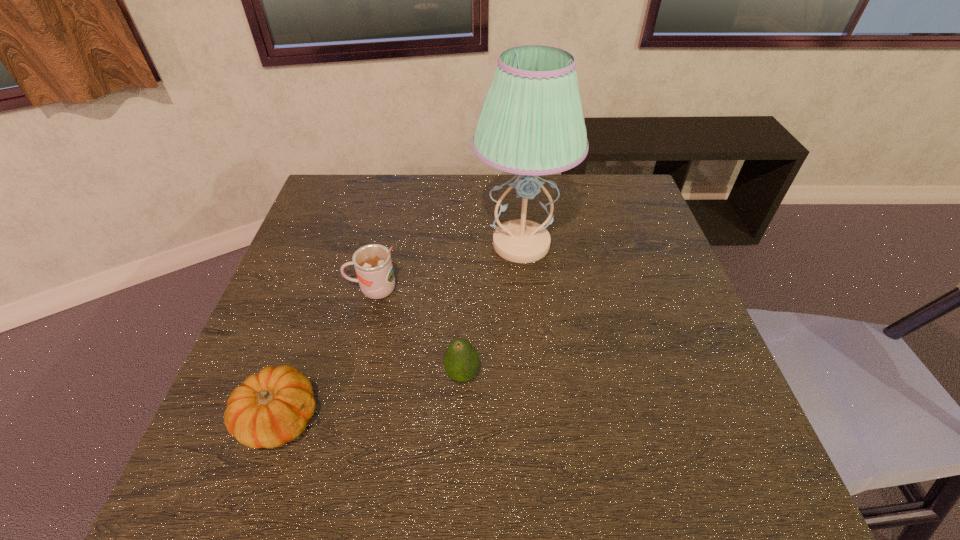
I want to click on the tallest object, so click(531, 123).

This screenshot has height=540, width=960. I want to click on the third shortest object, so click(373, 265).

The image size is (960, 540). What are the coordinates of `avocado` in the screenshot? It's located at (461, 360).

At what (x,y) coordinates should I click in order to perform the action: click on gourd. Please return your answer as a coordinate pair (x, y). Looking at the image, I should click on (271, 408).

The width and height of the screenshot is (960, 540). What are the coordinates of `vacant area situated on the left of the lamp` in the screenshot? It's located at (393, 244).

Locate an element on the screen. Image resolution: width=960 pixels, height=540 pixels. free space located on the side with the handle of the second tallest object is located at coordinates (294, 289).

You are a GUI agent. You are given a task and a screenshot of the screen. Output one action in this format:
    pyautogui.click(x=<x>, y=<y>)
    Task: Click on the vacant space located on the side with the handle of the second tallest object
    The height and width of the screenshot is (540, 960).
    Given the screenshot: What is the action you would take?
    pyautogui.click(x=309, y=289)

Where is `vacant space located 0.100m on the side with the handle of the second tallest object`? The height and width of the screenshot is (540, 960). vacant space located 0.100m on the side with the handle of the second tallest object is located at coordinates tap(305, 289).

In order to click on vacant space situated on the left of the avocado in this screenshot , I will do `click(257, 375)`.

Locate an element on the screen. Image resolution: width=960 pixels, height=540 pixels. vacant region located 0.100m on the right of the gourd is located at coordinates (372, 418).